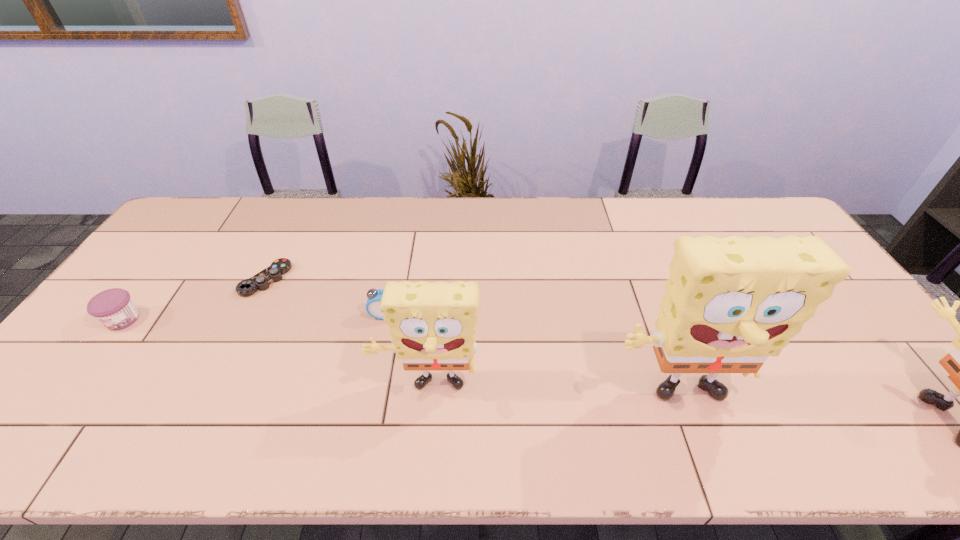
Where is `free region located 0.260m on the face of the alarm clock`? This screenshot has width=960, height=540. free region located 0.260m on the face of the alarm clock is located at coordinates (367, 405).

The height and width of the screenshot is (540, 960). I want to click on object at the left edge, so click(114, 308).

Locate an element on the screen. The image size is (960, 540). vacant space at the far edge is located at coordinates (255, 225).

Where is `free point at the near edge`? This screenshot has height=540, width=960. free point at the near edge is located at coordinates (418, 404).

Identify the location of vacant space at the left edge of the desktop. The width and height of the screenshot is (960, 540). (174, 295).

In the image, there is a desktop. Where is `vacant space at the far left corner`? vacant space at the far left corner is located at coordinates (191, 228).

Where is `free spot at the far right corner of the desktop`? The height and width of the screenshot is (540, 960). free spot at the far right corner of the desktop is located at coordinates (743, 226).

Locate an element on the screen. This screenshot has height=540, width=960. unoccupied area between the shortest sponge and the leftmost object is located at coordinates (276, 354).

This screenshot has height=540, width=960. I want to click on vacant area that lies between the leftmost object and the alarm clock, so click(x=254, y=318).

This screenshot has height=540, width=960. Identify the location of unoccupied position between the fourth tallest object and the fifth object from right to left. (325, 298).